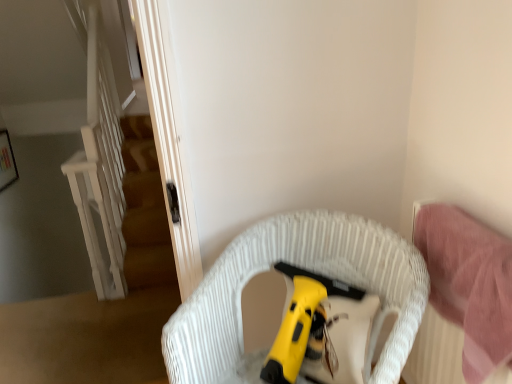
Question: Considering the relative positions of yellow plastic vacuum cleaner at center and white woven chair at center in the image provided, is yellow plastic vacuum cleaner at center to the left or to the right of white woven chair at center?

Choices:
 (A) left
 (B) right

Answer: (B)

Question: From the image's perspective, is yellow plastic vacuum cleaner at center located above or below white woven chair at center?

Choices:
 (A) below
 (B) above

Answer: (B)

Question: Based on their relative distances, which object is farther from the pink fabric bed at right?

Choices:
 (A) white woven chair at center
 (B) yellow plastic vacuum cleaner at center

Answer: (A)

Question: Which object is the farthest from the white woven chair at center?

Choices:
 (A) yellow plastic vacuum cleaner at center
 (B) pink fabric bed at right

Answer: (B)